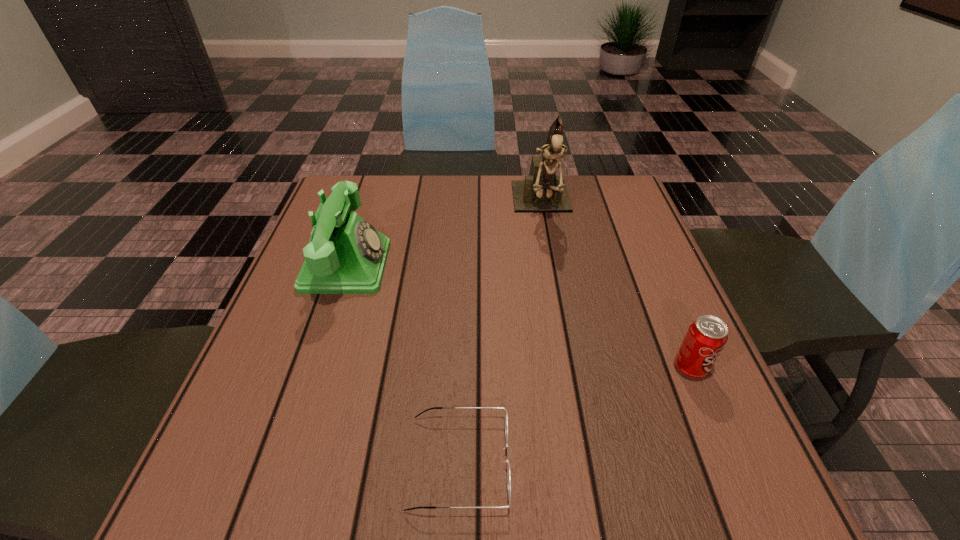
Identify the location of vacant space located on the back of the second nearest object. The width and height of the screenshot is (960, 540). (645, 261).

You are a GUI agent. You are given a task and a screenshot of the screen. Output one action in this format:
    pyautogui.click(x=<x>, y=<y>)
    Task: Click on the free region located on the front-facing side of the shortest object
    This screenshot has width=960, height=540.
    Given the screenshot: What is the action you would take?
    pyautogui.click(x=613, y=462)

At what (x,y) coordinates should I click in order to perform the action: click on object that is at the far edge. Please return your answer as a coordinate pair (x, y). Looking at the image, I should click on (542, 190).

Locate an element on the screen. object that is at the near edge is located at coordinates (503, 408).

Locate an element on the screen. The height and width of the screenshot is (540, 960). object that is at the left edge is located at coordinates (346, 255).

The image size is (960, 540). In order to click on object at the right edge in this screenshot , I will do `click(706, 337)`.

Image resolution: width=960 pixels, height=540 pixels. Identify the location of free spot at the far edge of the desktop. (412, 199).

The width and height of the screenshot is (960, 540). I want to click on vacant region at the left edge of the desktop, so coord(328,301).

Locate an element on the screen. This screenshot has width=960, height=540. free spot at the right edge of the desktop is located at coordinates (716, 449).

I want to click on free space at the far left corner of the desktop, so click(x=368, y=206).